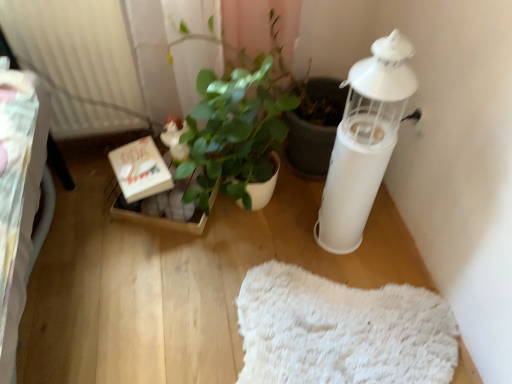
What is the approximate width of white cardboard box at center, arranged as the 1th cardboard box when viewed from the front?

white cardboard box at center, arranged as the 1th cardboard box when viewed from the front, is 8.35 inches in width.

In order to face green glossy plant at center, should I rotate leftwards or rightwards?

To align with it, rotate left about 2.263°.

Image resolution: width=512 pixels, height=384 pixels. What do you see at coordinates (161, 220) in the screenshot?
I see `wooden cardboard box at center, marked as the second cardboard box in a front-to-back arrangement` at bounding box center [161, 220].

The image size is (512, 384). In order to click on white cardboard box at center, which appears as the second cardboard box when viewed from the back in this screenshot , I will do `click(140, 169)`.

Which object is wider, white cardboard box at center, arranged as the 1th cardboard box when viewed from the front, or white matte candle holder at right?

With larger width is white cardboard box at center, arranged as the 1th cardboard box when viewed from the front.

Who is taller, white cardboard box at center, arranged as the 1th cardboard box when viewed from the front, or white matte candle holder at right?

Standing taller between the two is white matte candle holder at right.

How different are the orientations of white cardboard box at center, arranged as the 1th cardboard box when viewed from the front, and white matte candle holder at right in degrees?

white cardboard box at center, arranged as the 1th cardboard box when viewed from the front, and white matte candle holder at right are facing 105 degrees away from each other.

From the image's perspective, is white cardboard box at center, arranged as the 1th cardboard box when viewed from the front, located above or below white matte candle holder at right?

white cardboard box at center, arranged as the 1th cardboard box when viewed from the front, is below white matte candle holder at right.

From a real-world perspective, which is physically above, white fluffy mat at lower center or white ribbed radiator at upper left?

In real-world perspective, white ribbed radiator at upper left is above.

Between point (312, 305) and point (35, 62), which one is positioned behind?

The point (35, 62) is farther from the camera.

Which object is thinner, white fluffy mat at lower center or white ribbed radiator at upper left?

Thinner between the two is white ribbed radiator at upper left.

How many degrees apart are the facing directions of white fluffy mat at lower center and white ribbed radiator at upper left?

The facing directions of white fluffy mat at lower center and white ribbed radiator at upper left are 22.5 degrees apart.

Which object is positioned more to the right, green glossy plant at center or white matte candle holder at right?

From the viewer's perspective, white matte candle holder at right appears more on the right side.

From a real-world perspective, is green glossy plant at center below white matte candle holder at right?

Correct, in the physical world, green glossy plant at center is lower than white matte candle holder at right.

Is point (254, 132) farther from camera compared to point (339, 149)?

Yes, point (254, 132) is behind point (339, 149).

Can you confirm if white matte candle holder at right is wider than green glossy plant at center?

Incorrect, the width of white matte candle holder at right does not surpass that of green glossy plant at center.

What's the angular difference between white matte candle holder at right and green glossy plant at center's facing directions?

The angular difference between white matte candle holder at right and green glossy plant at center is 90 degrees.

From the image's perspective, is white matte candle holder at right over green glossy plant at center?

Incorrect, from the image's perspective, white matte candle holder at right is lower than green glossy plant at center.

Between white fluffy mat at lower center and white matte candle holder at right, which one appears on the left side from the viewer's perspective?

Positioned to the left is white fluffy mat at lower center.

This screenshot has height=384, width=512. What are the coordinates of `candle holder to the right of white fluffy mat at lower center` in the screenshot? It's located at (364, 141).

Is white fluffy mat at lower center turned away from white matte candle holder at right?

Yes, white fluffy mat at lower center is facing away from white matte candle holder at right.

Does white fluffy mat at lower center have a lesser height compared to white matte candle holder at right?

Indeed, white fluffy mat at lower center has a lesser height compared to white matte candle holder at right.

Does wooden cardboard box at center, the 1th cardboard box viewed from the back, appear on the left side of white fluffy mat at lower center?

Correct, you'll find wooden cardboard box at center, the 1th cardboard box viewed from the back, to the left of white fluffy mat at lower center.

From the image's perspective, is wooden cardboard box at center, the 1th cardboard box viewed from the back, positioned above or below white fluffy mat at lower center?

wooden cardboard box at center, the 1th cardboard box viewed from the back, is above white fluffy mat at lower center.

From a real-world perspective, which cardboard box is the 1st one above the white fluffy mat at lower center? Please provide its 2D coordinates.

[(161, 220)]

Considering the relative positions of wooden cardboard box at center, the 1th cardboard box viewed from the back, and white fluffy mat at lower center in the image provided, is wooden cardboard box at center, the 1th cardboard box viewed from the back, behind white fluffy mat at lower center?

That is True.

The width and height of the screenshot is (512, 384). Find the location of `the 1st cardboard box positioned below the white ribbed radiator at upper left (from a real-world perspective)`. the 1st cardboard box positioned below the white ribbed radiator at upper left (from a real-world perspective) is located at coordinates (140, 169).

From a real-world perspective, is white cardboard box at center, arranged as the 1th cardboard box when viewed from the front, physically above white ribbed radiator at upper left?

Incorrect, from a real-world perspective, white cardboard box at center, arranged as the 1th cardboard box when viewed from the front, is lower than white ribbed radiator at upper left.

How different are the orientations of white cardboard box at center, arranged as the 1th cardboard box when viewed from the front, and white ribbed radiator at upper left in degrees?

They differ by 16 degrees in their facing directions.

In terms of width, does white cardboard box at center, which appears as the second cardboard box when viewed from the back, look wider or thinner when compared to white ribbed radiator at upper left?

In the image, white cardboard box at center, which appears as the second cardboard box when viewed from the back, appears to be wider than white ribbed radiator at upper left.

You are a GUI agent. You are given a task and a screenshot of the screen. Output one action in this format:
    pyautogui.click(x=<x>, y=<y>)
    Task: Click on the candle holder lying above the white cardboard box at center, arranged as the 1th cardboard box when viewed from the front (from the image's perspective)
    
    Given the screenshot: What is the action you would take?
    pyautogui.click(x=364, y=141)

The width and height of the screenshot is (512, 384). I want to click on mat that appears below the white ribbed radiator at upper left (from the image's perspective), so click(341, 331).

Considering their positions, is wooden cardboard box at center, marked as the second cardboard box in a front-to-back arrangement, positioned closer to white cardboard box at center, which appears as the second cardboard box when viewed from the back, than white ribbed radiator at upper left?

Based on the image, wooden cardboard box at center, marked as the second cardboard box in a front-to-back arrangement, appears to be nearer to white cardboard box at center, which appears as the second cardboard box when viewed from the back.

Looking at the image, which one is located closer to white cardboard box at center, which appears as the second cardboard box when viewed from the back, white ribbed radiator at upper left or green glossy plant at center?

Among the two, green glossy plant at center is located nearer to white cardboard box at center, which appears as the second cardboard box when viewed from the back.

Looking at the image, which one is located closer to wooden cardboard box at center, marked as the second cardboard box in a front-to-back arrangement, white ribbed radiator at upper left or green glossy plant at center?

green glossy plant at center is positioned closer to the anchor wooden cardboard box at center, marked as the second cardboard box in a front-to-back arrangement.

Based on their spatial positions, is white cardboard box at center, which appears as the second cardboard box when viewed from the back, or green glossy plant at center further from white ribbed radiator at upper left?

green glossy plant at center.

Based on their spatial positions, is green glossy plant at center or white fluffy mat at lower center closer to white matte candle holder at right?

green glossy plant at center is closer to white matte candle holder at right.

In the scene shown: Which object lies further to the anchor point white fluffy mat at lower center, wooden cardboard box at center, marked as the second cardboard box in a front-to-back arrangement, or green glossy plant at center?

Based on the image, wooden cardboard box at center, marked as the second cardboard box in a front-to-back arrangement, appears to be further to white fluffy mat at lower center.

Which object lies nearer to the anchor point white ribbed radiator at upper left, green glossy plant at center or white cardboard box at center, which appears as the second cardboard box when viewed from the back?

Based on the image, white cardboard box at center, which appears as the second cardboard box when viewed from the back, appears to be nearer to white ribbed radiator at upper left.

From the image, which object appears to be nearer to wooden cardboard box at center, the 1th cardboard box viewed from the back, green glossy plant at center or white ribbed radiator at upper left?

green glossy plant at center lies closer to wooden cardboard box at center, the 1th cardboard box viewed from the back, than the other object.

Find the location of a particular element. This screenshot has width=512, height=384. houseplant between white ribbed radiator at upper left and white matte candle holder at right in the horizontal direction is located at coordinates (244, 119).

Find the location of `mat between white ribbed radiator at upper left and white matte candle holder at right from left to right`. mat between white ribbed radiator at upper left and white matte candle holder at right from left to right is located at coordinates (341, 331).

This screenshot has width=512, height=384. Find the location of `candle holder between green glossy plant at center and wooden cardboard box at center, the 1th cardboard box viewed from the back, along the z-axis`. candle holder between green glossy plant at center and wooden cardboard box at center, the 1th cardboard box viewed from the back, along the z-axis is located at coordinates (364, 141).

Identify the location of cardboard box between green glossy plant at center and wooden cardboard box at center, the 1th cardboard box viewed from the back, in the front-back direction. Image resolution: width=512 pixels, height=384 pixels. (140, 169).